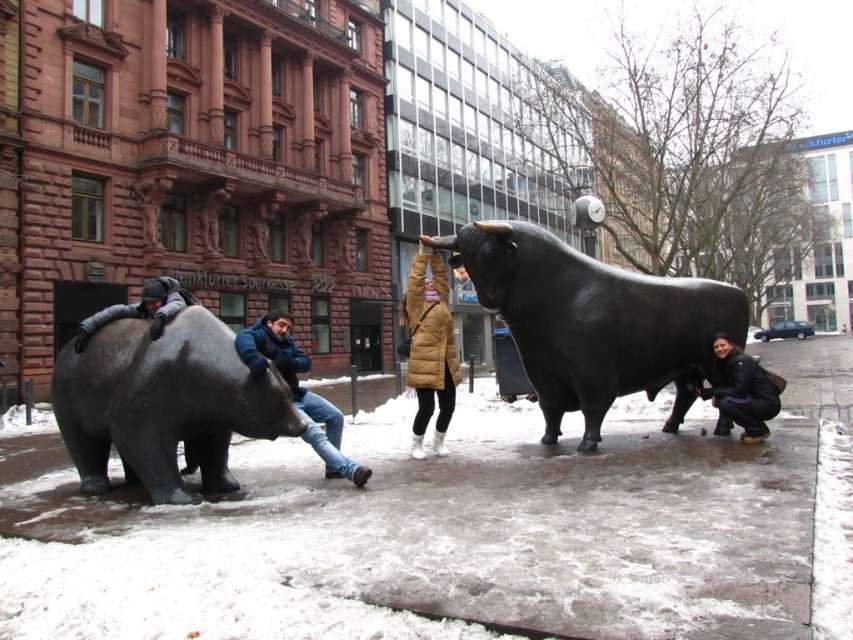
Looking at this image, you are an artist planning to paint the shiny black bull at center and the black matte jacket at lower right. Since you want to emphasize their size difference, which object should you paint larger on your canvas?

You should paint the shiny black bull at center larger than the black matte jacket at lower right because the shiny black bull at center is larger in size compared to the black matte jacket at lower right.

You are a photographer trying to capture a photo of the shiny black bull at center and the black matte jacket at lower right. You want to ensure both are visible in the frame. Based on their positions, which object should you place closer to the left side of your camera viewfinder?

The shiny black bull at center should be placed closer to the left side of your camera viewfinder because it is positioned on the left side of the black matte jacket at lower right.